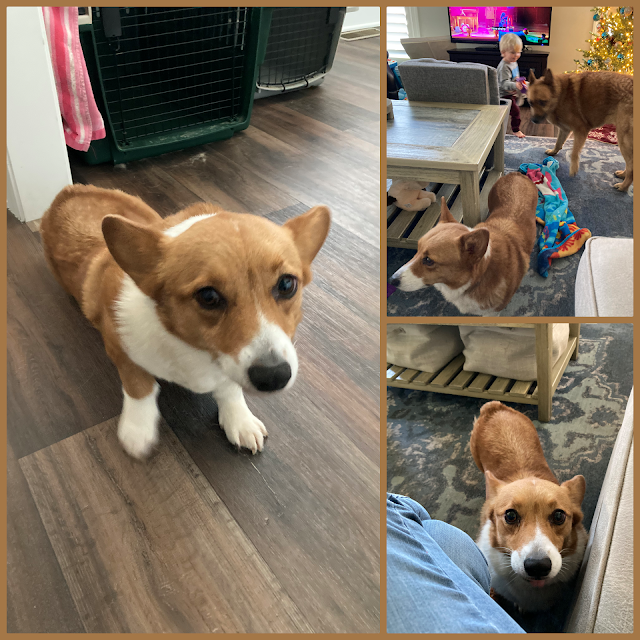
Where is `christmas tree with lights`? This screenshot has height=640, width=640. christmas tree with lights is located at coordinates (610, 54).